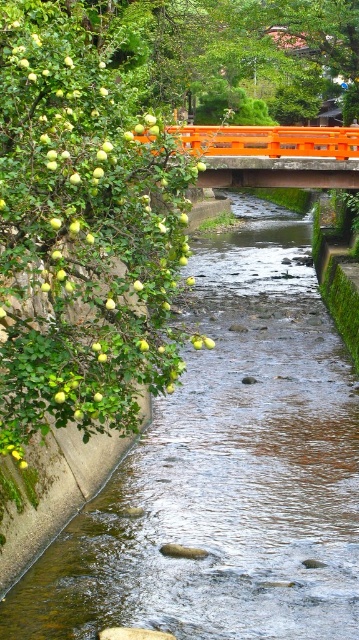
You are standing at the edge of the stream and want to cross it to the other side. The stream is flowing from left to right. There is a point marked at coordinates (226, 470) which is clear water at stream center. Where should you step to cross the stream safely?

You should step at the point marked at coordinates (226, 470) because it is clear water at stream center, indicating a safe crossing point.

You are a hiker who wants to cross the stream using the orange painted wooden bridge at center. However, you notice the clear water at stream center flowing strongly. Is the bridge positioned to your left or right side of the stream?

The clear water at stream center is to the left of the orange painted wooden bridge at center, which means the bridge is on the right side of the stream. Therefore, the bridge is positioned to your right side of the stream.

You are a hiker wanting to cross the stream using the orange painted wooden bridge at center. However, you notice the clear water at stream center is flowing. Do you think the bridge is wider than the stream?

The clear water at stream center is thinner than the orange painted wooden bridge at center, so the bridge is wider than the stream. Therefore, the bridge should be wide enough to cross safely.